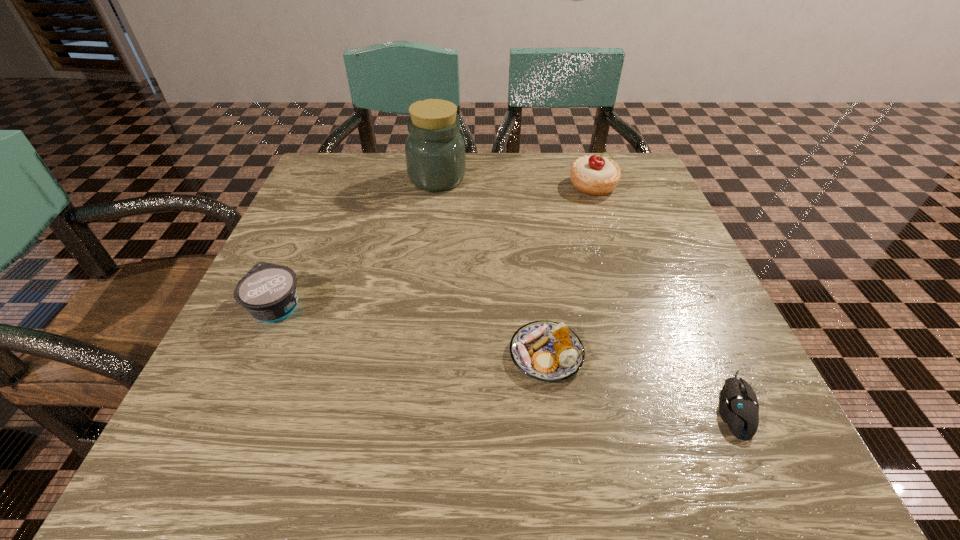
This screenshot has width=960, height=540. I want to click on object that is the closest to the third object from left to right, so click(738, 407).

You are a GUI agent. You are given a task and a screenshot of the screen. Output one action in this format:
    pyautogui.click(x=<x>, y=<y>)
    Task: Click on the object that can be found as the third closest to the yogurt
    The height and width of the screenshot is (540, 960).
    Given the screenshot: What is the action you would take?
    pyautogui.click(x=595, y=175)

In order to click on vacant point that satisfies the following two spatial constraints: 1. on the front side of the right pastry; 2. on the left side of the jar in this screenshot , I will do `click(437, 186)`.

I want to click on vacant area in the image that satisfies the following two spatial constraints: 1. on the front side of the shortest object; 2. on the right side of the fourth object from right to left, so click(x=408, y=406).

Where is `vacant space that satisfies the following two spatial constraints: 1. on the front side of the nearer pastry; 2. on the left side of the jar`? vacant space that satisfies the following two spatial constraints: 1. on the front side of the nearer pastry; 2. on the left side of the jar is located at coordinates (415, 355).

You are a GUI agent. You are given a task and a screenshot of the screen. Output one action in this format:
    pyautogui.click(x=<x>, y=<y>)
    Task: Click on the vacant space that satisfies the following two spatial constraints: 1. on the back side of the yogurt; 2. on the right side of the tallest object
    
    Given the screenshot: What is the action you would take?
    pyautogui.click(x=334, y=179)